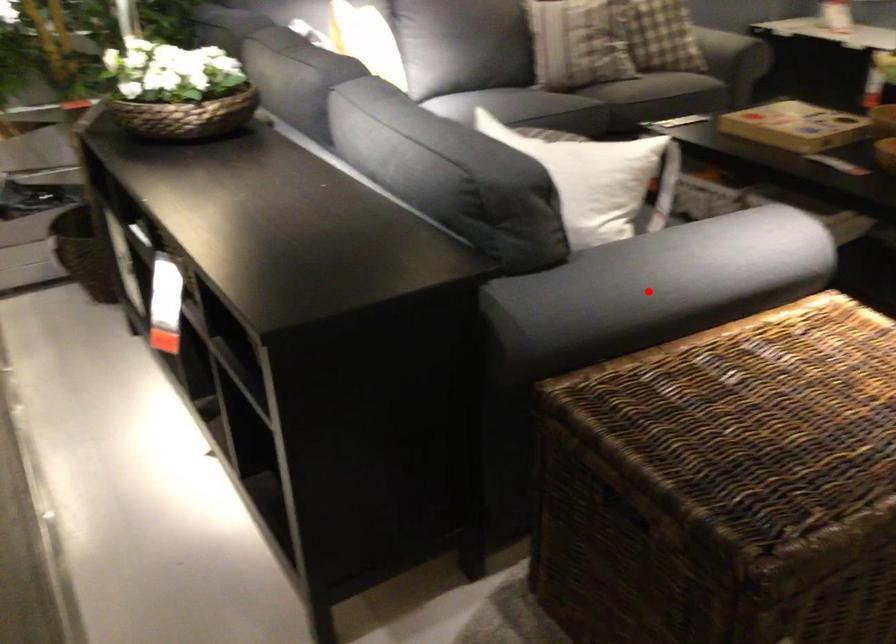
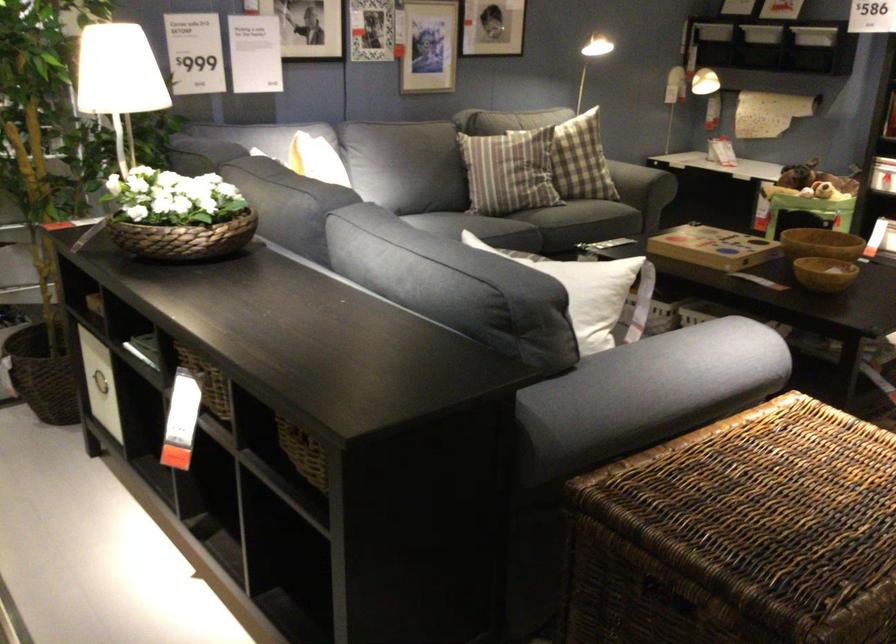
Question: A red point is marked in image1. In image2, is the corresponding 3D point closer to the camera or farther? Reply with the corresponding letter.

Choices:
 (A) The corresponding 3D point is closer.
 (B) The corresponding 3D point is farther.

Answer: (B)